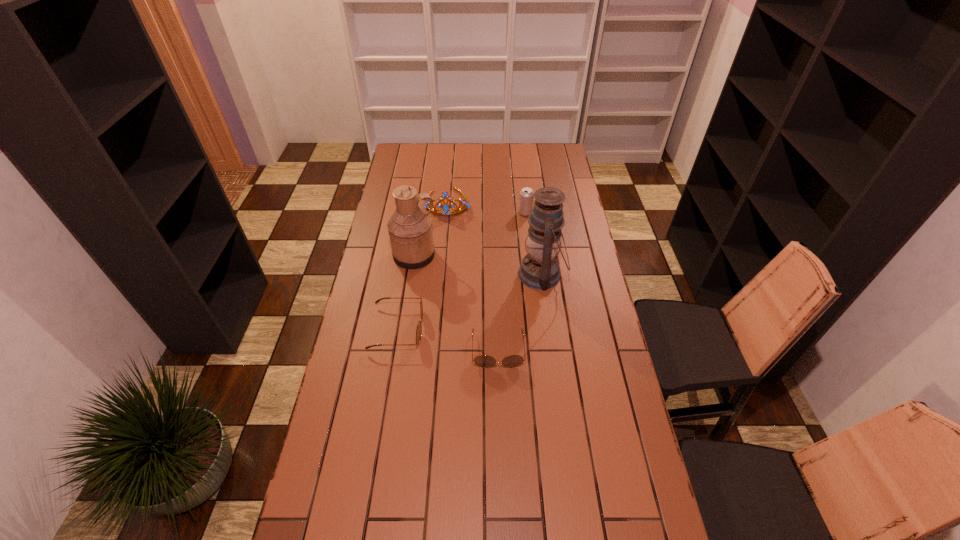
You are a GUI agent. You are given a task and a screenshot of the screen. Output one action in this format:
    pyautogui.click(x=<x>, y=<y>)
    Task: Click on the fifth tallest object
    Image resolution: width=960 pixels, height=540 pixels.
    Given the screenshot: What is the action you would take?
    pyautogui.click(x=419, y=328)

You are a GUI agent. You are given a task and a screenshot of the screen. Output one action in this format:
    pyautogui.click(x=<x>, y=<y>)
    Task: Click on the left sunglasses
    The width and height of the screenshot is (960, 540).
    Given the screenshot: What is the action you would take?
    pyautogui.click(x=419, y=328)

The width and height of the screenshot is (960, 540). Find the location of `the shortest object`. the shortest object is located at coordinates (485, 361).

At what (x,y) coordinates should I click in order to perform the action: click on the shorter sunglasses. Please return your answer as a coordinate pair (x, y). The height and width of the screenshot is (540, 960). Looking at the image, I should click on (485, 361).

Identify the location of tiara. Image resolution: width=960 pixels, height=540 pixels. (446, 209).

In order to click on beer can in this screenshot , I will do `click(526, 197)`.

This screenshot has height=540, width=960. What are the coordinates of `oil lamp` in the screenshot? It's located at (539, 269).

At what (x,y) coordinates should I click in order to perform the action: click on pitcher. Please return your answer as a coordinate pair (x, y). Looking at the image, I should click on (410, 228).

Find the location of a particular element. The image size is (960, 540). vacant space situated 0.130m on the lenses of the left sunglasses is located at coordinates (461, 328).

At what (x,y) coordinates should I click in order to perform the action: click on vacant region located on the lenses of the shortest object. Please return your answer as a coordinate pair (x, y). The image size is (960, 540). Looking at the image, I should click on (500, 409).